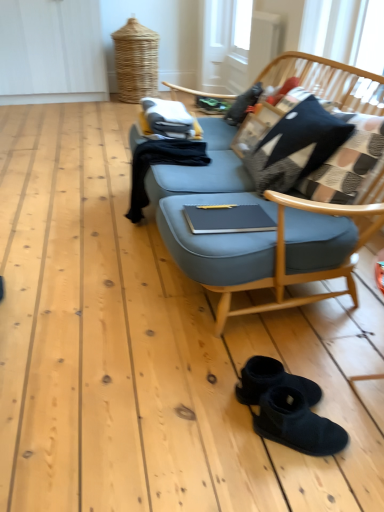
Question: Can you confirm if black suede boots at lower center is thinner than plaid fabric pillow at upper right?

Choices:
 (A) no
 (B) yes

Answer: (A)

Question: Is plaid fabric pillow at upper right located within black suede boots at lower center?

Choices:
 (A) no
 (B) yes

Answer: (A)

Question: Is black suede boots at lower center beside plaid fabric pillow at upper right?

Choices:
 (A) no
 (B) yes

Answer: (A)

Question: Is black suede boots at lower center to the right of plaid fabric pillow at upper right from the viewer's perspective?

Choices:
 (A) yes
 (B) no

Answer: (B)

Question: Is black suede boots at lower center taller than plaid fabric pillow at upper right?

Choices:
 (A) no
 (B) yes

Answer: (A)

Question: From a real-world perspective, is black suede boots at lower center positioned over plaid fabric pillow at upper right based on gravity?

Choices:
 (A) yes
 (B) no

Answer: (B)

Question: Can you confirm if plaid fabric pillow at upper right is thinner than black suede boots at lower center?

Choices:
 (A) no
 (B) yes

Answer: (B)

Question: Does plaid fabric pillow at upper right appear on the right side of black suede boots at lower center?

Choices:
 (A) no
 (B) yes

Answer: (B)

Question: Is plaid fabric pillow at upper right positioned with its back to black suede boots at lower center?

Choices:
 (A) no
 (B) yes

Answer: (A)

Question: From the image's perspective, is plaid fabric pillow at upper right above black suede boots at lower center?

Choices:
 (A) yes
 (B) no

Answer: (A)

Question: Is plaid fabric pillow at upper right smaller than black suede boots at lower center?

Choices:
 (A) yes
 (B) no

Answer: (B)

Question: Is plaid fabric pillow at upper right next to black suede boots at lower center and touching it?

Choices:
 (A) no
 (B) yes

Answer: (A)

Question: In the image, is black suede boots at lower center on the left side or the right side of plaid fabric pillow at upper right?

Choices:
 (A) right
 (B) left

Answer: (B)